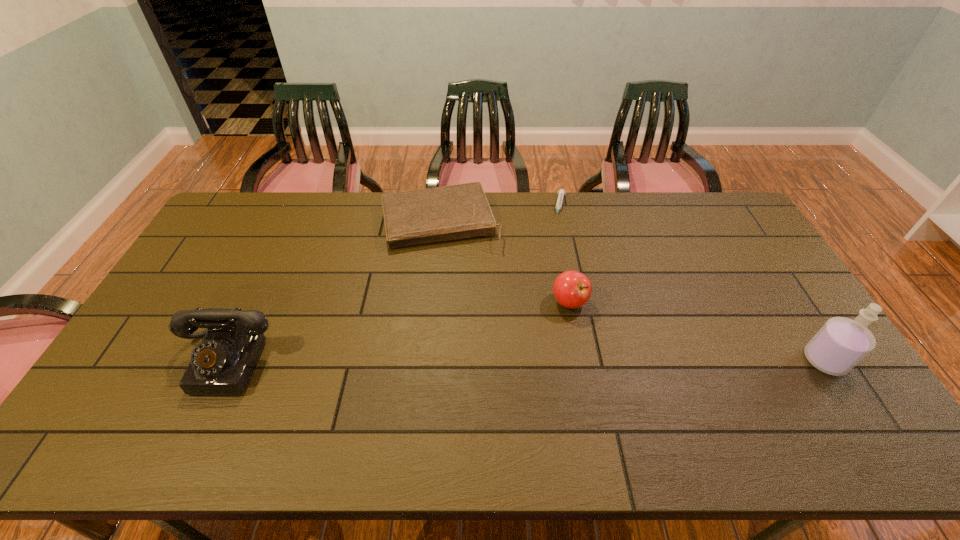
Find the location of a particular element. This screenshot has height=540, width=960. vacant space located 0.230m on the stem of the apple is located at coordinates (574, 386).

This screenshot has height=540, width=960. Identify the location of vacant area situated on the stem of the apple. point(574,379).

Image resolution: width=960 pixels, height=540 pixels. Find the location of `vacant space located on the stem of the apple`. vacant space located on the stem of the apple is located at coordinates (575, 400).

Locate an element on the screen. This screenshot has width=960, height=540. vacant space located 0.310m at the needle end of the shortest object is located at coordinates (549, 279).

Locate an element on the screen. free space located at the needle end of the shortest object is located at coordinates (546, 295).

At what (x,y) coordinates should I click in order to perform the action: click on free space located at the needle end of the shortest object. Please return your answer as a coordinate pair (x, y). Looking at the image, I should click on (550, 277).

In order to click on vacant space located 0.110m on the spine side of the second object from left to right in this screenshot , I will do `click(457, 275)`.

Where is `vacant space located on the spine side of the second object from left to right`? Image resolution: width=960 pixels, height=540 pixels. vacant space located on the spine side of the second object from left to right is located at coordinates (461, 291).

At what (x,y) coordinates should I click in order to perform the action: click on free region located on the spine side of the second object from left to right. Please return your answer as a coordinate pair (x, y). The image size is (960, 540). Looking at the image, I should click on (462, 293).

Where is `syringe located at the far edge`? This screenshot has height=540, width=960. syringe located at the far edge is located at coordinates (561, 192).